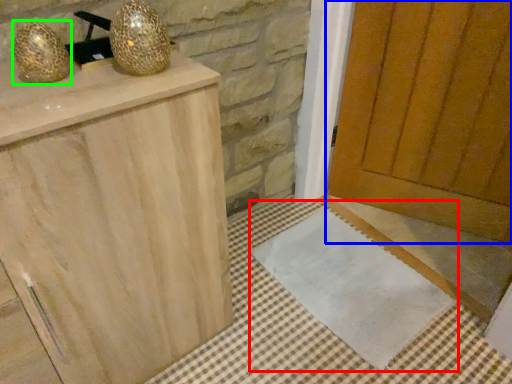
Question: Considering the real-world distances, which object is closest to doormat (highlighted by a red box)? door (highlighted by a blue box) or disco ball (highlighted by a green box).

Choices:
 (A) door
 (B) disco ball

Answer: (A)